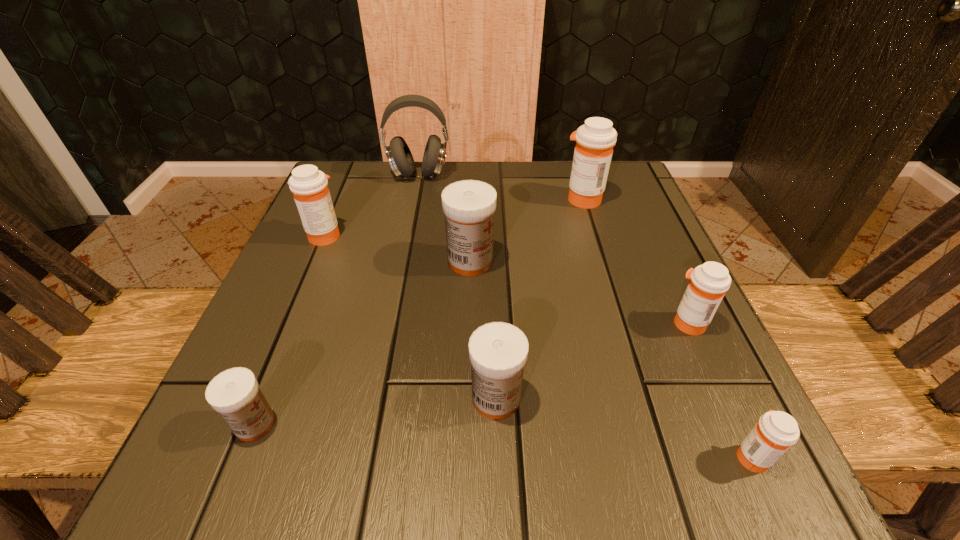
You are a GUI agent. You are given a task and a screenshot of the screen. Output one action in this format:
    pyautogui.click(x=<x>, y=<y>)
    Task: Click on the headset positioned at the far edge
    
    Given the screenshot: What is the action you would take?
    pyautogui.click(x=399, y=156)

Where is `medicine present at the far edge`? medicine present at the far edge is located at coordinates [x=595, y=140].

Image resolution: width=960 pixels, height=540 pixels. I want to click on headset situated at the left edge, so click(x=399, y=156).

Locate an element on the screen. object positioned at the far left corner is located at coordinates (399, 156).

You are a GUI agent. You are given a task and a screenshot of the screen. Output one action in this format:
    pyautogui.click(x=<x>, y=<y>)
    Task: Click on the object present at the near left corner
    
    Given the screenshot: What is the action you would take?
    pyautogui.click(x=234, y=393)

Image resolution: width=960 pixels, height=540 pixels. I want to click on object that is at the far right corner, so tap(595, 140).

You are a GUI agent. You are given a task and a screenshot of the screen. Output one action in this format:
    pyautogui.click(x=<x>, y=<y>)
    Task: Click on the object located in the near right corner section of the desktop
    The width and height of the screenshot is (960, 540).
    Given the screenshot: What is the action you would take?
    pyautogui.click(x=775, y=432)

The image size is (960, 540). In order to click on free location at the far edge of the desktop in this screenshot , I will do `click(503, 164)`.

The height and width of the screenshot is (540, 960). What are the coordinates of `vacant space at the near edge` in the screenshot? It's located at [650, 497].

In the image, there is a desktop. At what (x,y) coordinates should I click in order to perform the action: click on vacant space at the right edge. Please return your answer as a coordinate pair (x, y). The width and height of the screenshot is (960, 540). Looking at the image, I should click on (660, 231).